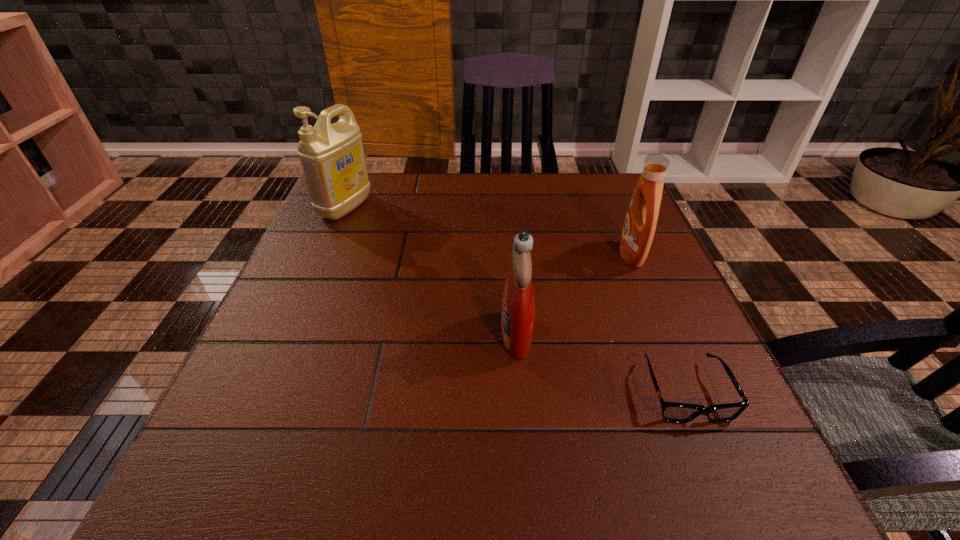
This screenshot has height=540, width=960. I want to click on vacant area between the sunglasses and the second nearest detergent, so pyautogui.click(x=659, y=323).

In order to click on vacant area between the second nearest detergent and the tallest detergent in this screenshot , I will do `click(489, 231)`.

At what (x,y) coordinates should I click in order to perform the action: click on vacant space in between the nearest detergent and the rightmost detergent. Please return your answer as a coordinate pair (x, y). The width and height of the screenshot is (960, 540). Looking at the image, I should click on [574, 294].

Locate an element on the screen. This screenshot has width=960, height=540. vacant space in between the nearest detergent and the rightmost detergent is located at coordinates (574, 294).

Locate which object is the second closest to the second farthest object. Please provide its 2D coordinates. Your answer should be formatted as a tuple, i.e. [(x, y)], where the tuple contains the x and y coordinates of a point satisfying the conditions above.

[(518, 305)]

Select which object appears as the second closest to the sunglasses. Please provide its 2D coordinates. Your answer should be formatted as a tuple, i.e. [(x, y)], where the tuple contains the x and y coordinates of a point satisfying the conditions above.

[(639, 228)]

Select which detergent appears as the closest to the nearest detergent. Please provide its 2D coordinates. Your answer should be formatted as a tuple, i.e. [(x, y)], where the tuple contains the x and y coordinates of a point satisfying the conditions above.

[(639, 228)]

Identify which detergent is the nearest to the shortest object. Please provide its 2D coordinates. Your answer should be formatted as a tuple, i.e. [(x, y)], where the tuple contains the x and y coordinates of a point satisfying the conditions above.

[(518, 305)]

Locate an element on the screen. The width and height of the screenshot is (960, 540). free space that satisfies the following two spatial constraints: 1. on the front-facing side of the third nearest object; 2. on the front-facing side of the sunglasses is located at coordinates (688, 392).

Find the location of a particular element. This screenshot has height=540, width=960. free space that satisfies the following two spatial constraints: 1. on the front-facing side of the rightmost detergent; 2. on the front-facing side of the sunglasses is located at coordinates (688, 392).